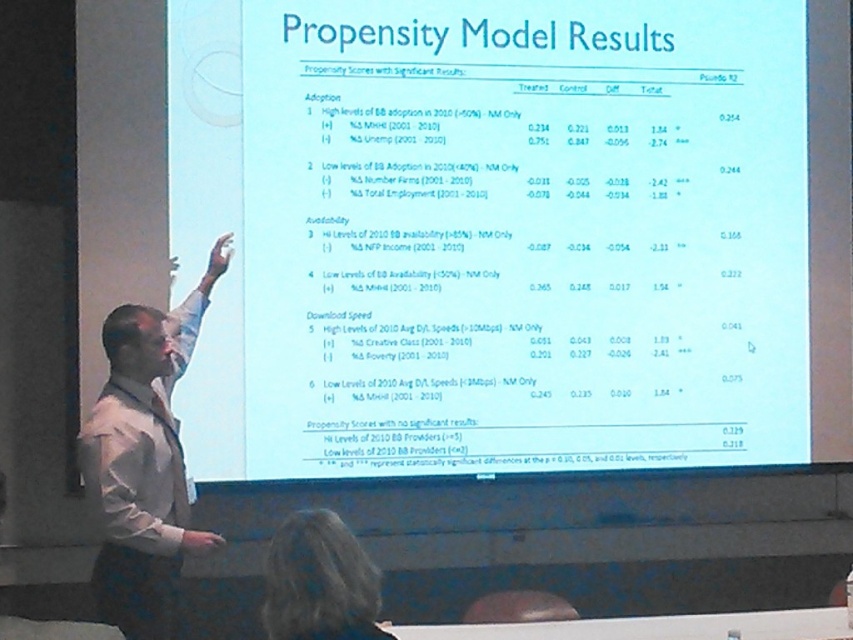
Can you confirm if white paper at upper center is positioned to the left of white shirt at left?

No, white paper at upper center is not to the left of white shirt at left.

Looking at this image, is white paper at upper center above white shirt at left?

Correct, white paper at upper center is located above white shirt at left.

Between point (434, 308) and point (115, 525), which one is positioned behind?

The point (434, 308) is more distant.

Where is `white paper at upper center`? white paper at upper center is located at coordinates 492,234.